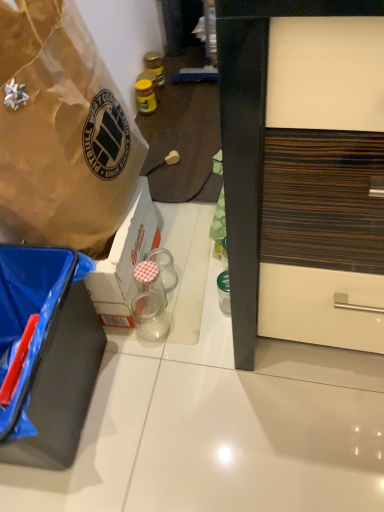
Question: In terms of width, does clear glass jar at center, which is the second coffee cup from bottom to top, look wider or thinner when compared to transparent glass jar at center, which is counted as the 2th coffee cup, starting from the top?

Choices:
 (A) wide
 (B) thin

Answer: (B)

Question: Based on their positions, is clear glass jar at center, arranged as the first coffee cup when viewed from the top, located to the left or right of transparent glass jar at center, which is the first coffee cup in bottom-to-top order?

Choices:
 (A) right
 (B) left

Answer: (A)

Question: Based on their relative distances, which object is farther from the matte plastic power outlet at center?

Choices:
 (A) transparent glass jar at center, which is the first coffee cup in bottom-to-top order
 (B) yellow glass jar at upper center, the second bottle in the back-to-front sequence
 (C) clear glass jar at center, which is the second coffee cup from bottom to top
 (D) black matte box at lower left, arranged as the 2th box when viewed from the top
 (E) brown paper bag at upper left, which appears as the 1th box when viewed from the top

Answer: (D)

Question: Based on their relative distances, which object is farther from the yellow glass jar at upper center, which ranks as the second bottle in bottom-to-top order?

Choices:
 (A) matte plastic power outlet at center
 (B) brown paper bag at upper left, which appears as the 1th box when viewed from the top
 (C) transparent glass jar at center, which ranks as the first bottle in bottom-to-top order
 (D) clear glass jar at center, arranged as the first coffee cup when viewed from the top
 (E) black matte box at lower left, the first box in the bottom-to-top sequence

Answer: (E)